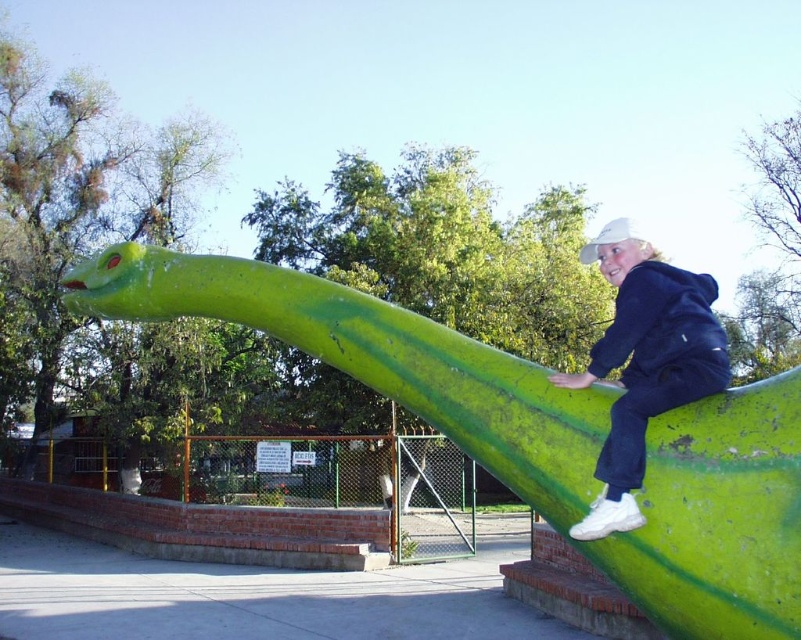
Question: Can you confirm if green matte slide at upper right is positioned below white matte sneakers at upper right?

Choices:
 (A) no
 (B) yes

Answer: (A)

Question: Is green matte slide at upper right closer to the viewer compared to white matte sneakers at upper right?

Choices:
 (A) no
 (B) yes

Answer: (B)

Question: Which point appears farthest from the camera in this image?

Choices:
 (A) (663, 353)
 (B) (757, 579)

Answer: (A)

Question: Does green matte slide at upper right have a larger size compared to white matte sneakers at upper right?

Choices:
 (A) no
 (B) yes

Answer: (B)

Question: Which point is farther to the camera?

Choices:
 (A) white matte sneakers at upper right
 (B) green matte slide at upper right

Answer: (A)

Question: Which object is farther from the camera taking this photo?

Choices:
 (A) green matte slide at upper right
 (B) white matte sneakers at upper right

Answer: (B)